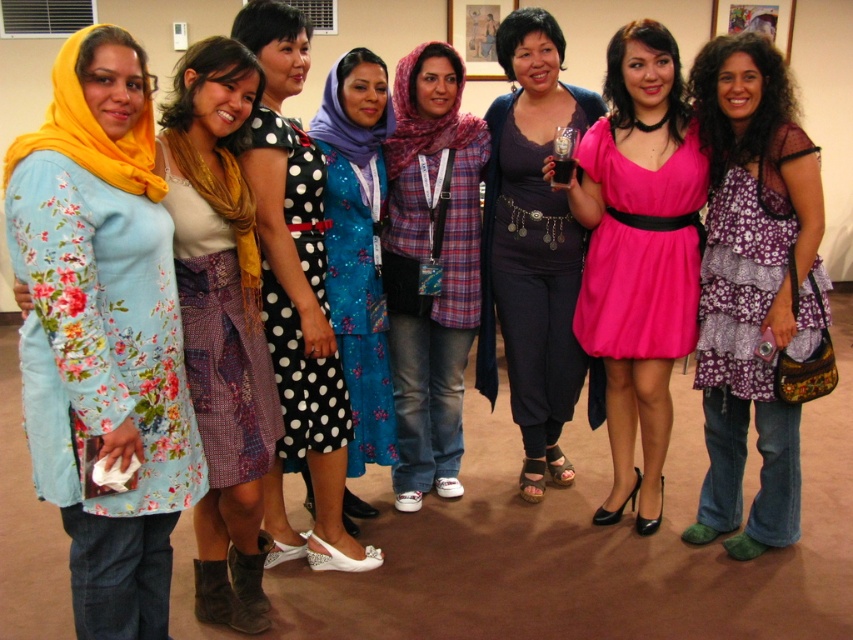
Between purple floral dress at center and patchwork fabric dress at center, which one is positioned lower?

patchwork fabric dress at center is lower down.

Does purple floral dress at center appear under patchwork fabric dress at center?

No, purple floral dress at center is not below patchwork fabric dress at center.

Where is `purple floral dress at center`? The width and height of the screenshot is (853, 640). purple floral dress at center is located at coordinates (753, 285).

You are a GUI agent. You are given a task and a screenshot of the screen. Output one action in this format:
    pyautogui.click(x=<x>, y=<y>)
    Task: Click on the purple floral dress at center
    Image resolution: width=853 pixels, height=640 pixels.
    Given the screenshot: What is the action you would take?
    pyautogui.click(x=753, y=285)

Consider the image. Is pink chiffon dress at center taller than black polka dot dress at center?

No, pink chiffon dress at center is not taller than black polka dot dress at center.

Can you confirm if pink chiffon dress at center is thinner than black polka dot dress at center?

No, pink chiffon dress at center is not thinner than black polka dot dress at center.

Is point (627, 282) farther from camera compared to point (317, 403)?

Yes.

Find the location of a particular element. The height and width of the screenshot is (640, 853). pink chiffon dress at center is located at coordinates (641, 252).

Is plaid fabric headscarf at center further to the viewer compared to pink chiffon dress at center?

Yes, it is behind pink chiffon dress at center.

Between point (405, 108) and point (585, 332), which one is positioned behind?

The point (405, 108) is more distant.

At what (x,y) coordinates should I click in order to perform the action: click on plaid fabric headscarf at center. Please return your answer as a coordinate pair (x, y). Looking at the image, I should click on (431, 266).